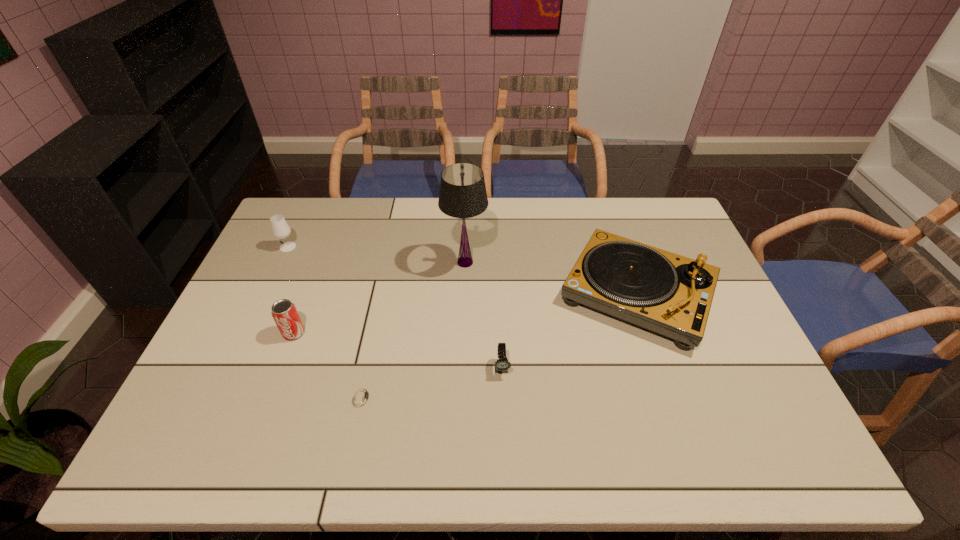
Locate an element on the screen. This screenshot has height=540, width=960. lampshade is located at coordinates (462, 194).

Where is `the tallest object`? the tallest object is located at coordinates (462, 194).

The image size is (960, 540). Identify the location of glass. [280, 228].

What are the coordinates of `the rightmost object` in the screenshot? It's located at (669, 294).

Identify the location of the fifth object from right to left. This screenshot has height=540, width=960. (284, 312).

Find the location of a particular element. The height and width of the screenshot is (540, 960). the farther watch is located at coordinates (502, 364).

Locate an element on the screen. This screenshot has width=960, height=540. the taller watch is located at coordinates (502, 364).

Locate an element on the screen. the shorter watch is located at coordinates click(x=361, y=397).

Image resolution: width=960 pixels, height=540 pixels. I want to click on the nearer watch, so click(361, 397).

The width and height of the screenshot is (960, 540). What are the coordinates of `vacant position located 0.370m on the front-facing side of the lampshade` in the screenshot? It's located at click(x=601, y=262).